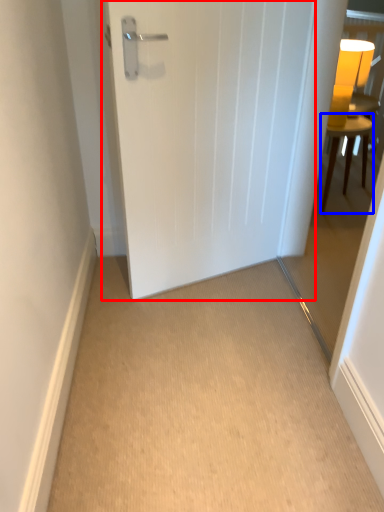
Question: Which object appears farthest to the camera in this image, door (highlighted by a red box) or furniture (highlighted by a blue box)?

Choices:
 (A) door
 (B) furniture

Answer: (B)